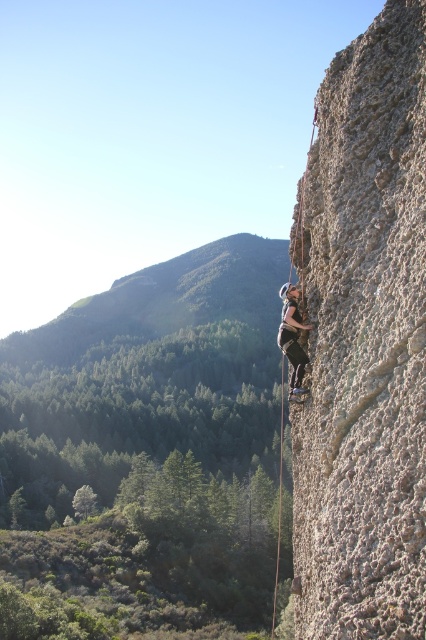
You are a safety inspector evaluating the climbing setup. The gray rough rock at right and the matte gray helmet at center are both visible in your line of sight. According to safety protocols, which object should be lower in position to ensure the climber is properly anchored?

The gray rough rock at right should be located below the matte gray helmet at center to ensure proper anchoring, which matches the current setup described in the Objects Description.

You are a climber assessing the rock face. You notice a point marked at coordinates (363, 340). Based on the scene description, what type of surface is located at that point?

The point at coordinates (363, 340) corresponds to gray rough rock at right.

You are a safety inspector assessing the climbing site. You notice the gray rough rock at right and the matte gray helmet at center. Which object is positioned higher in the scene?

The gray rough rock at right is much taller than the matte gray helmet at center, so it is positioned higher in the scene.